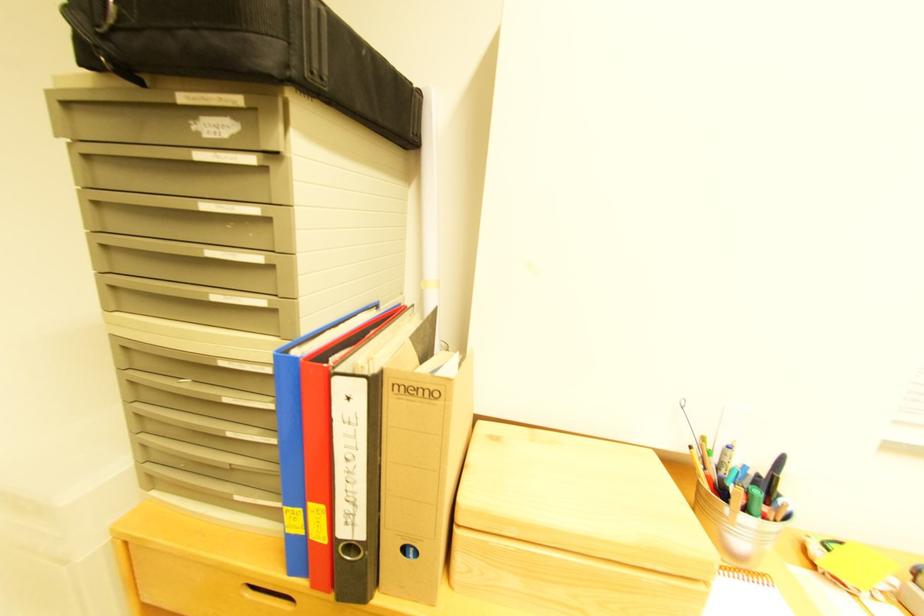
Find where to lift the spiral notebook. Please return your answer as a coordinate pair (x, y).

(360, 456)